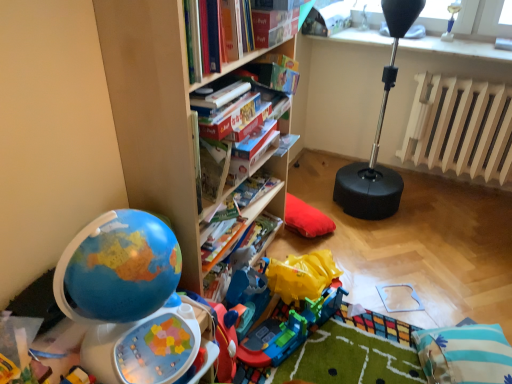
Identify the location of free space above black rubber punching bag at upper right (from a real-world perspective). (419, 40).